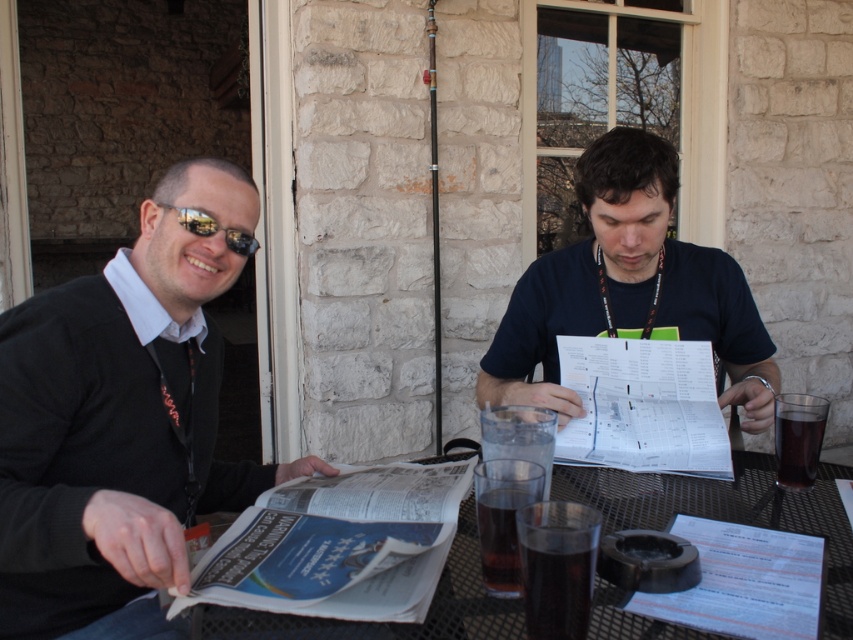
Question: Which point is closer to the camera?

Choices:
 (A) matte black sweater at left
 (B) dark brown glass at table right

Answer: (A)

Question: Can you confirm if matte black sweater at left is thinner than dark brown liquid at table center?

Choices:
 (A) yes
 (B) no

Answer: (B)

Question: Does matte black sweater at left appear on the right side of dark glass at table center?

Choices:
 (A) no
 (B) yes

Answer: (A)

Question: Among these objects, which one is nearest to the camera?

Choices:
 (A) matte black sweater at left
 (B) dark blue t-shirt at center

Answer: (A)

Question: Which point is farther to the camera?

Choices:
 (A) 585,182
 (B) 645,486

Answer: (A)

Question: Is dark blue t-shirt at center wider than dark glass at table center?

Choices:
 (A) yes
 (B) no

Answer: (A)